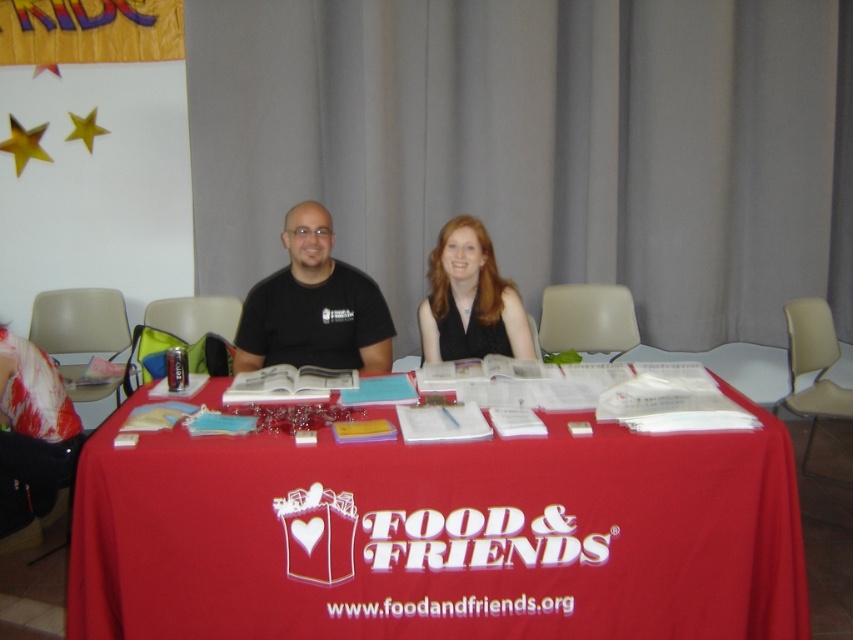
Consider the image. You are setting up a booth for an event and need to place a large banner on the table. Given the objects on the table, will the red cloth table at center have enough space to accommodate the banner if it is the same size as the matte black vest at center?

The red cloth table at center is bigger than matte black vest at center, so yes, the red cloth table at center has enough space to accommodate the banner of the same size as the matte black vest at center.

You are standing at the entrance of the community event and want to locate the table with the logo for FOOD AND FRIENDS. According to the image, where is the red cloth table at center located?

The red cloth table at center is located at point (x=439, y=536).